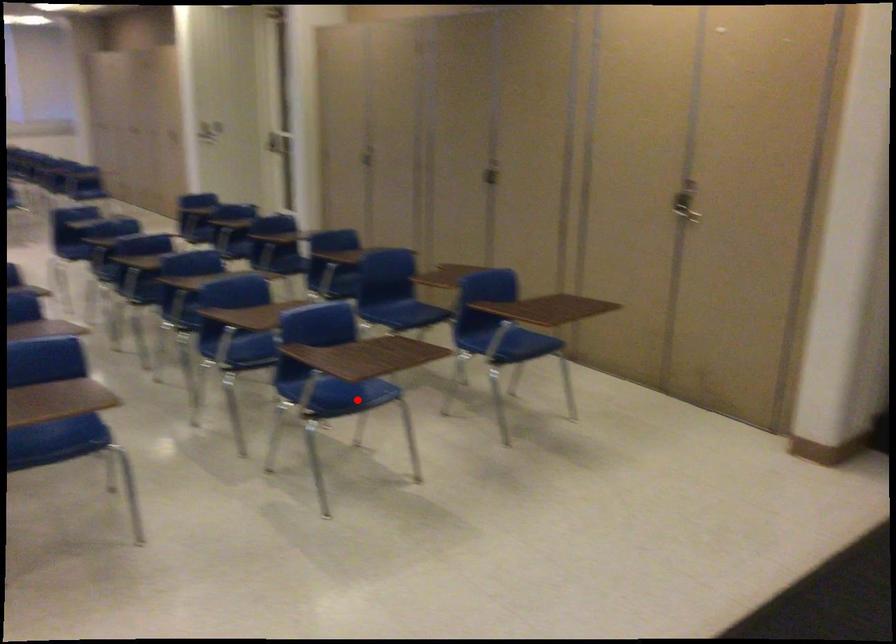
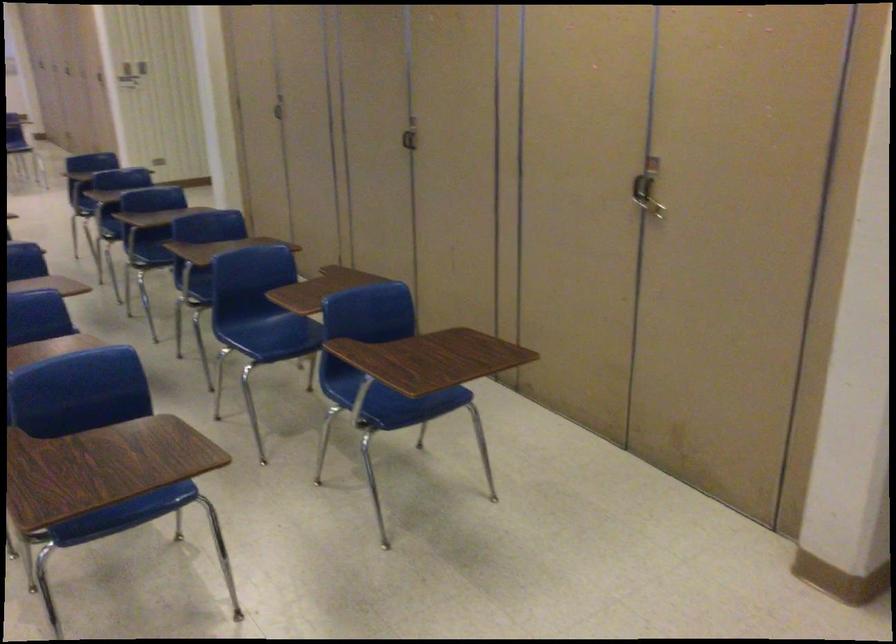
Where in the second image is the point corresponding to the highlighted location from the first image?

(126, 516)